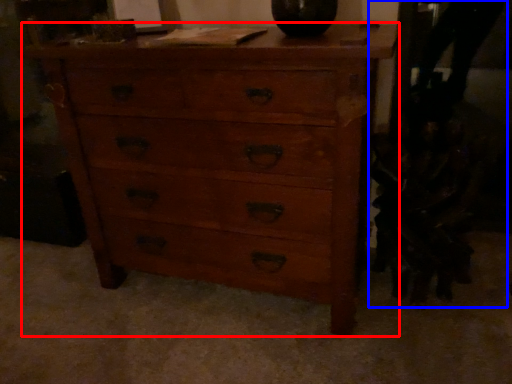
Question: Which of the following is the farthest to the observer, chest of drawers (highlighted by a red box) or swivel chair (highlighted by a blue box)?

Choices:
 (A) chest of drawers
 (B) swivel chair

Answer: (B)